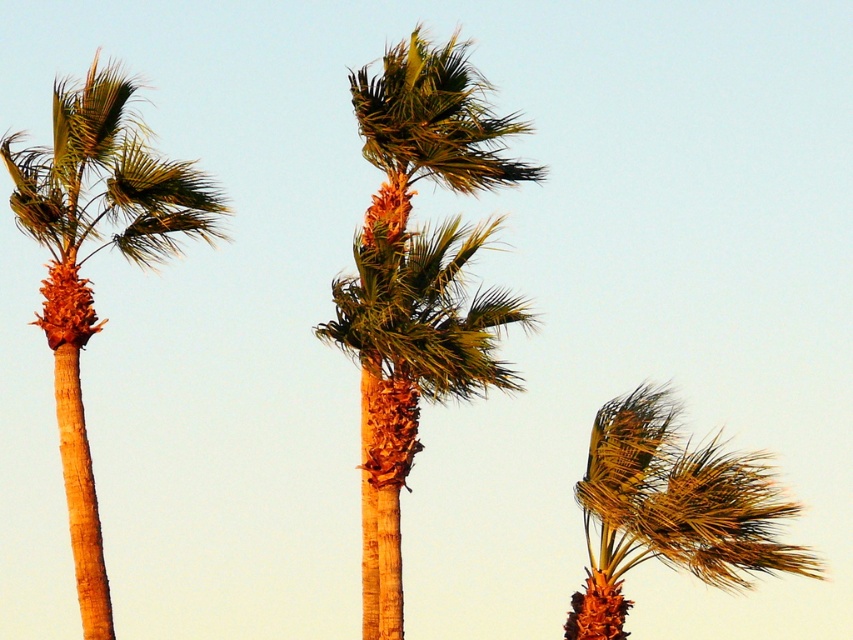
You are standing at the center of the image and want to locate the green leafy palm tree at center. What are its coordinates?

The green leafy palm tree at center is located at coordinates point (416, 282).

You are standing in front of the three palm trees shown in the image. You notice two specific points marked in the scene. Which of these two points, point 1 at coordinates point (55, 172) or point 2 at coordinates point (733, 458), is nearer to you?

Point 1 at coordinates point (55, 172) is closer to the viewer than point 2 at coordinates point (733, 458).

You are standing in front of the three palm trees and want to take a photo. You notice two points in the scene labeled as point 1 and point 2. Point 1 is at coordinate point (x=456, y=52) and point 2 is at coordinate point (x=67, y=392). Which point is closer to your camera lens?

Point (x=456, y=52) is further to the camera than point (x=67, y=392), so point (x=67, y=392) is closer to the camera lens.